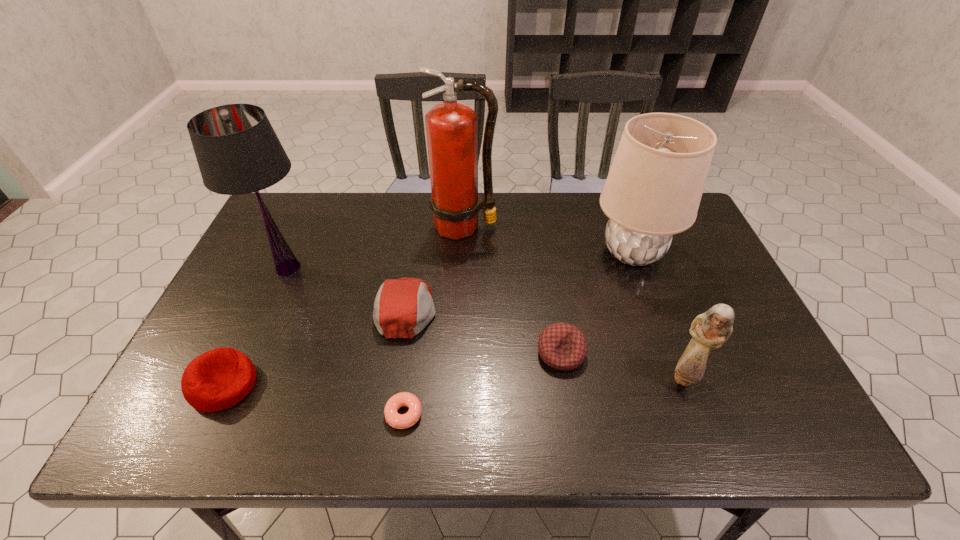
This screenshot has width=960, height=540. I want to click on vacant region between the third object from right to left and the fire extinguisher, so click(x=513, y=290).

Locate an element on the screen. The image size is (960, 540). free area in between the taller beanbag and the fire extinguisher is located at coordinates (344, 306).

Locate which object is the sixth closest to the shorter lampshade. Please provide its 2D coordinates. Your answer should be formatted as a tuple, i.e. [(x, y)], where the tuple contains the x and y coordinates of a point satisfying the conditions above.

[(238, 152)]

Locate which object ranks sixth in proximity to the left lampshade. Please provide its 2D coordinates. Your answer should be formatted as a tuple, i.e. [(x, y)], where the tuple contains the x and y coordinates of a point satisfying the conditions above.

[(653, 190)]

Image resolution: width=960 pixels, height=540 pixels. What are the coordinates of `vacant space that satisfies the following two spatial constraints: 1. on the front-facing side of the cap; 2. on the left side of the shortest object` in the screenshot? It's located at (390, 414).

Locate an element on the screen. vacant area in the image that satisfies the following two spatial constraints: 1. on the front-facing side of the cap; 2. on the back side of the doughnut is located at coordinates (390, 414).

Find the location of `vacant space that satisfies the following two spatial constraints: 1. on the front-facing side of the cap; 2. on the right side of the seventh tallest object`. vacant space that satisfies the following two spatial constraints: 1. on the front-facing side of the cap; 2. on the right side of the seventh tallest object is located at coordinates coord(399,353).

Identify the location of vacant region that satisfies the following two spatial constraints: 1. on the seat area of the left beanbag; 2. on the left side of the doughnut. (210, 414).

You are a GUI agent. You are given a task and a screenshot of the screen. Output one action in this format:
    pyautogui.click(x=<x>, y=<y>)
    Task: Click on the free space in the image that satisfies the following two spatial constraints: 1. on the front-facing side of the doughnut; 2. on the left side of the cap
    This screenshot has height=540, width=960.
    Given the screenshot: What is the action you would take?
    pyautogui.click(x=390, y=414)

Identify the location of free point that satisfies the following two spatial constraints: 1. on the back side of the shortest object; 2. on the front-facing side of the cap. The image size is (960, 540). (418, 309).